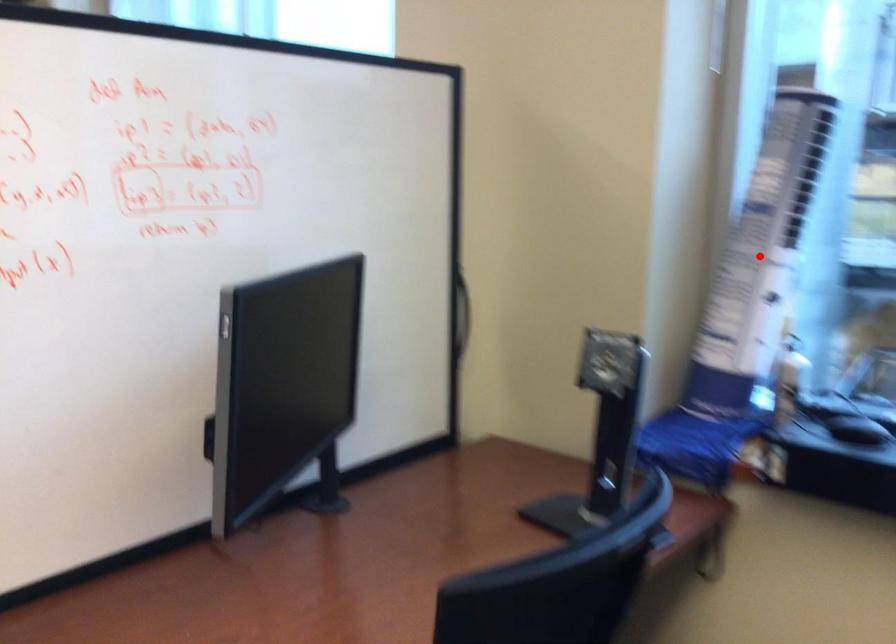
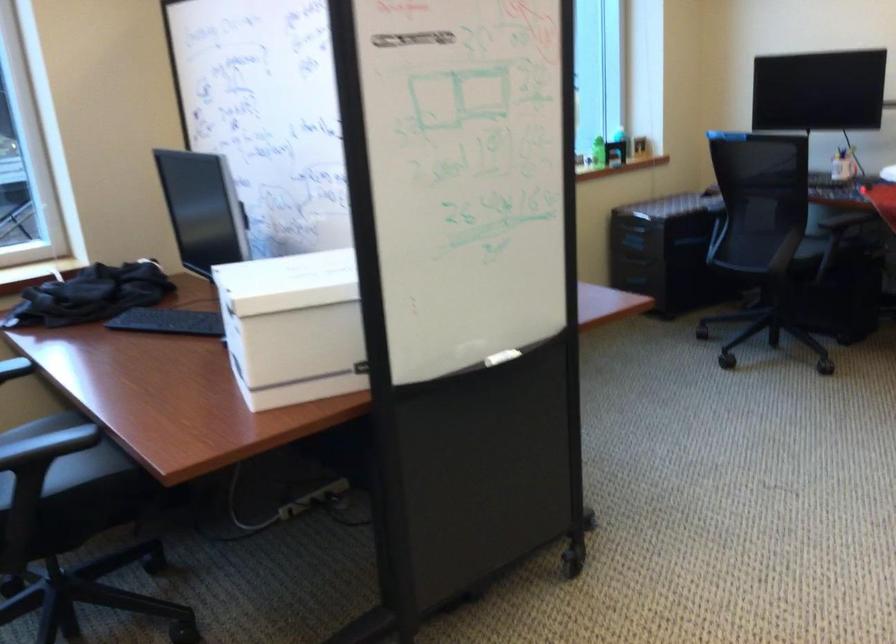
Question: I am providing you with two images of the same scene from different viewpoints. A red point is marked on the first image. At the location where the point appears in image 1, is it still visible in image 2?

Choices:
 (A) Yes
 (B) No

Answer: (B)